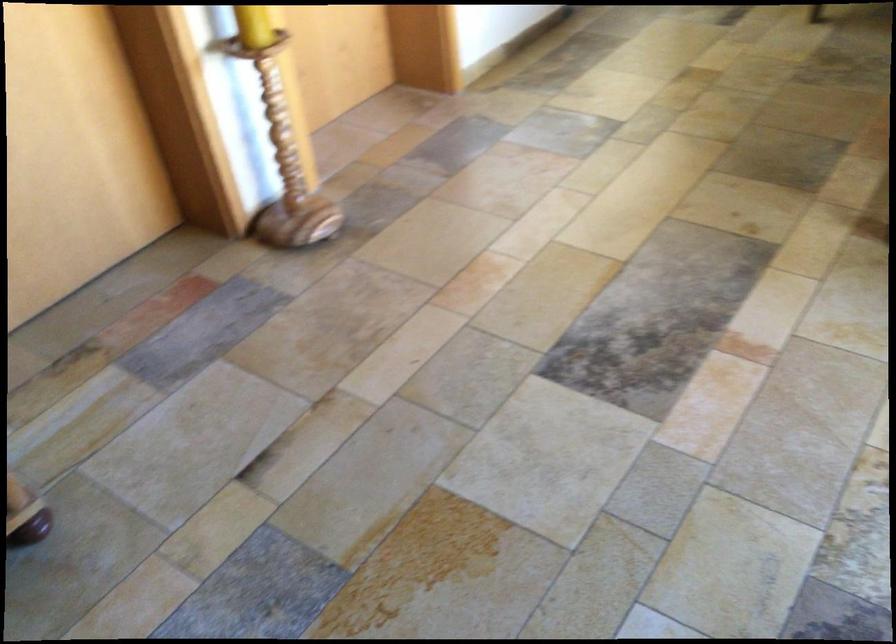
Question: Based on the continuous images, in which direction is the camera rotating? Reply with the corresponding letter.

Choices:
 (A) Left
 (B) Right
 (C) Up
 (D) Down

Answer: (B)